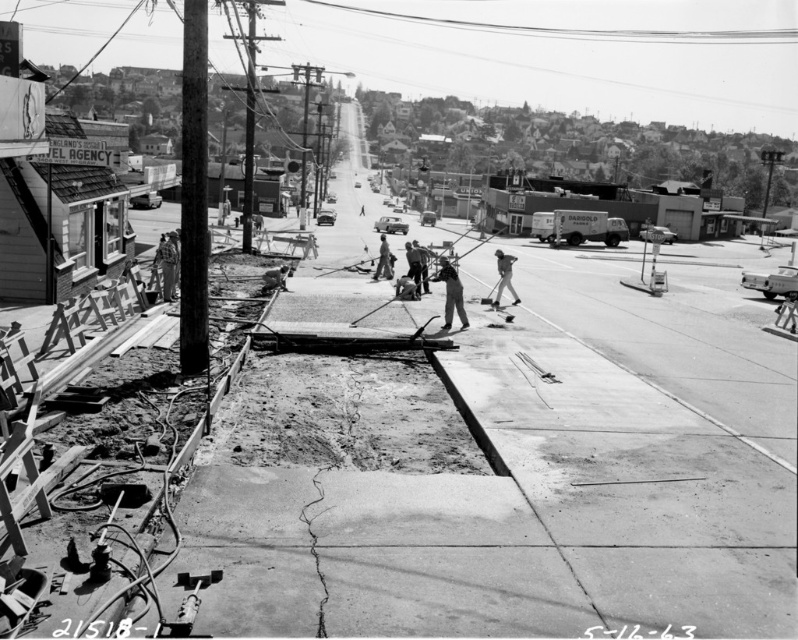
Question: Among these points, which one is nearest to the camera?

Choices:
 (A) (506, 285)
 (B) (162, 257)

Answer: (B)

Question: Is dark gray fabric jacket at center to the right of dark gray concrete worker at center from the viewer's perspective?

Choices:
 (A) no
 (B) yes

Answer: (B)

Question: Which object is positioned closest to the dark gray fabric jacket at center?

Choices:
 (A) metallic wire at upper center
 (B) dark gray uniform at center

Answer: (B)

Question: Which point appears farthest from the camera in this image?

Choices:
 (A) (516, 301)
 (B) (777, 28)
 (C) (440, 259)

Answer: (B)

Question: Can you confirm if light brown leather jacket at left is positioned above dark gray concrete worker at center?

Choices:
 (A) yes
 (B) no

Answer: (B)

Question: In this image, where is dark gray uniform at center located relative to dark gray concrete worker at center?

Choices:
 (A) right
 (B) left

Answer: (A)